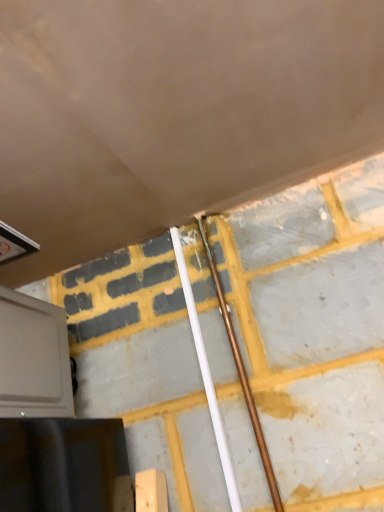
Question: Which direction should I rotate to face copper metallic pipe at center, placed as the 1th beam when sorted from right to left, — up or down?

Choices:
 (A) down
 (B) up

Answer: (A)

Question: Would you say copper metallic pipe at center, placed as the 1th beam when sorted from right to left, is outside gray matte oven at lower left?

Choices:
 (A) no
 (B) yes

Answer: (B)

Question: Does copper metallic pipe at center, placed as the 1th beam when sorted from right to left, have a larger size compared to gray matte oven at lower left?

Choices:
 (A) yes
 (B) no

Answer: (B)

Question: Is copper metallic pipe at center, arranged as the second beam when viewed from the left, behind gray matte oven at lower left?

Choices:
 (A) yes
 (B) no

Answer: (A)

Question: Could you tell me if copper metallic pipe at center, placed as the 1th beam when sorted from right to left, is turned towards gray matte oven at lower left?

Choices:
 (A) no
 (B) yes

Answer: (A)

Question: From the image's perspective, is copper metallic pipe at center, placed as the 1th beam when sorted from right to left, beneath gray matte oven at lower left?

Choices:
 (A) yes
 (B) no

Answer: (B)

Question: Can you confirm if copper metallic pipe at center, arranged as the second beam when viewed from the left, is wider than gray matte oven at lower left?

Choices:
 (A) no
 (B) yes

Answer: (A)

Question: Is white plastic pipe at center, the 1th beam from the left, thinner than gray matte oven at lower left?

Choices:
 (A) yes
 (B) no

Answer: (A)

Question: From the image's perspective, is white plastic pipe at center, the second beam when ordered from right to left, on top of gray matte oven at lower left?

Choices:
 (A) no
 (B) yes

Answer: (B)

Question: Can you confirm if white plastic pipe at center, the second beam when ordered from right to left, is positioned to the left of gray matte oven at lower left?

Choices:
 (A) yes
 (B) no

Answer: (B)

Question: Is white plastic pipe at center, the second beam when ordered from right to left, facing towards gray matte oven at lower left?

Choices:
 (A) yes
 (B) no

Answer: (B)

Question: Does white plastic pipe at center, the 1th beam from the left, have a lesser height compared to gray matte oven at lower left?

Choices:
 (A) no
 (B) yes

Answer: (A)

Question: Is white plastic pipe at center, the 1th beam from the left, wider than gray matte oven at lower left?

Choices:
 (A) yes
 (B) no

Answer: (B)

Question: Is white plastic pipe at center, the 1th beam from the left, oriented away from copper metallic pipe at center, placed as the 1th beam when sorted from right to left?

Choices:
 (A) yes
 (B) no

Answer: (B)